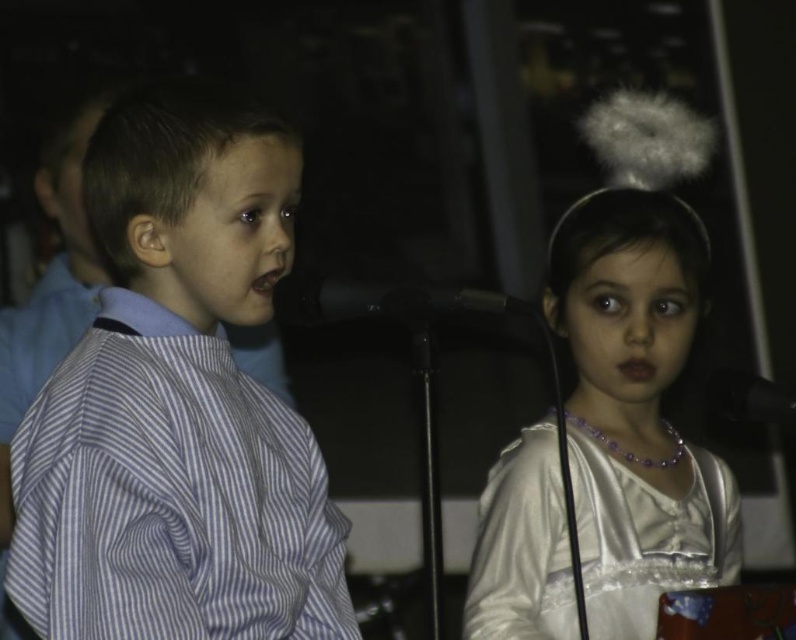
Does point (279, 464) come behind point (505, 308)?

Yes, point (279, 464) is behind point (505, 308).

The image size is (796, 640). I want to click on blue striped shirt at left, so (x=178, y=403).

What do you see at coordinates (178, 403) in the screenshot? I see `blue striped shirt at left` at bounding box center [178, 403].

Where is `blue striped shirt at left`? blue striped shirt at left is located at coordinates (178, 403).

Does blue striped shirt at left have a lesser width compared to silvery satin dress at center?

Correct, blue striped shirt at left's width is less than silvery satin dress at center's.

Is the position of blue striped shirt at left more distant than that of silvery satin dress at center?

No, blue striped shirt at left is closer to the viewer.

This screenshot has height=640, width=796. I want to click on blue striped shirt at left, so click(x=178, y=403).

Identify the location of blue striped shirt at left. This screenshot has width=796, height=640. (178, 403).

Who is lower down, blue striped shirt at left or white satin dress at lower right?

white satin dress at lower right

Between point (209, 164) and point (732, 532), which one is positioned behind?

Point (732, 532)

What are the coordinates of `blue striped shirt at left` in the screenshot? It's located at (178, 403).